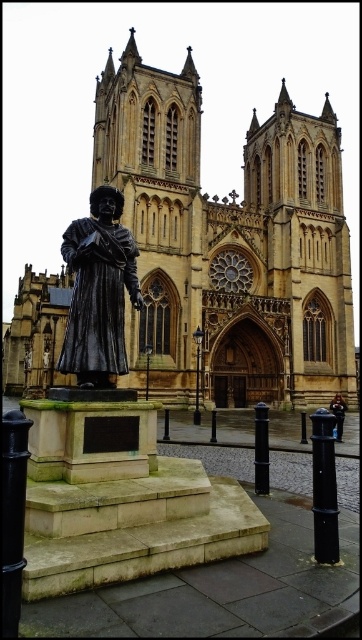
Does beige stone church at center have a greater width compared to polished bronze statue at center?

Yes, beige stone church at center is wider than polished bronze statue at center.

Is beige stone church at center taller than polished bronze statue at center?

Indeed, beige stone church at center has a greater height compared to polished bronze statue at center.

The width and height of the screenshot is (362, 640). What do you see at coordinates (229, 244) in the screenshot?
I see `beige stone church at center` at bounding box center [229, 244].

Where is `beige stone church at center`? This screenshot has height=640, width=362. beige stone church at center is located at coordinates pyautogui.click(x=229, y=244).